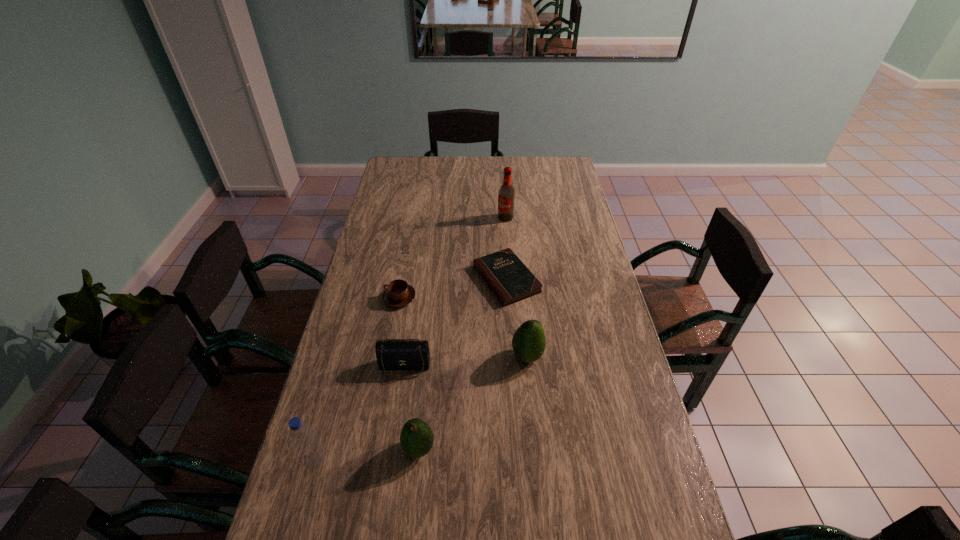
Where is `the shorter avocado`? the shorter avocado is located at coordinates (416, 438).

This screenshot has height=540, width=960. Find the location of `the left avocado`. the left avocado is located at coordinates (416, 438).

The width and height of the screenshot is (960, 540). Find the location of `the farther avocado`. the farther avocado is located at coordinates (529, 341).

Identify the location of the third tallest object. [529, 341].

The image size is (960, 540). Identify the location of the tallest object. (506, 195).

Find the location of a particular element. the farthest object is located at coordinates (506, 195).

Locate an element on the screen. The image size is (960, 540). cappuccino is located at coordinates (398, 293).

Find the location of a particular element. This screenshot has height=540, width=960. the shortest object is located at coordinates (506, 275).

The image size is (960, 540). I want to click on clutch bag, so click(392, 354).

Find the location of a particular element. Image resolution: width=960 pixels, height=540 pixels. the leftmost object is located at coordinates (311, 454).